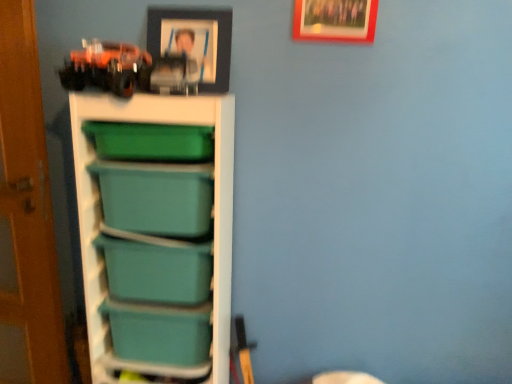
Image resolution: width=512 pixels, height=384 pixels. Describe the element at coordinates (159, 332) in the screenshot. I see `teal plastic storage bin at center, placed as the first box when sorted from bottom to top` at that location.

I want to click on teal plastic storage at left, so click(x=99, y=214).

What do you see at coordinates (99, 214) in the screenshot? This screenshot has height=384, width=512. I see `teal plastic storage at left` at bounding box center [99, 214].

How much space does wooden picture frame at upper center, which ranks as the second picture frame in left-to-right order, occupy horizontally?

wooden picture frame at upper center, which ranks as the second picture frame in left-to-right order, is 0.62 inches wide.

At what (x,y) coordinates should I click in order to perform the action: click on teal plastic storage bin at center, placed as the first box when sorted from bottom to top. Please return your answer as a coordinate pair (x, y). Looking at the image, I should click on (159, 332).

Can you confirm if teal plastic storage bin at center, placed as the first box when sorted from bottom to top, is wider than wooden picture frame at upper center, which ranks as the first picture frame in right-to-left order?

Yes.

Is teal plastic storage bin at center, the 2th box in the top-to-bottom sequence, further to the viewer compared to wooden picture frame at upper center, which ranks as the second picture frame in left-to-right order?

Yes, it is behind wooden picture frame at upper center, which ranks as the second picture frame in left-to-right order.

Which of these two, teal plastic storage bin at center, placed as the first box when sorted from bottom to top, or wooden picture frame at upper center, which ranks as the second picture frame in left-to-right order, is bigger?

teal plastic storage bin at center, placed as the first box when sorted from bottom to top.

Is wooden picture frame at upper center, which ranks as the second picture frame in left-to-right order, a part of teal plastic storage bin at center, the 2th box in the top-to-bottom sequence?

No, wooden picture frame at upper center, which ranks as the second picture frame in left-to-right order, is located outside of teal plastic storage bin at center, the 2th box in the top-to-bottom sequence.

Does point (296, 25) come behind point (169, 315)?

No.

From the image's perspective, would you say wooden picture frame at upper center, which ranks as the second picture frame in left-to-right order, is positioned over teal plastic storage bin at center, placed as the first box when sorted from bottom to top?

Indeed, from the image's perspective, wooden picture frame at upper center, which ranks as the second picture frame in left-to-right order, is shown above teal plastic storage bin at center, placed as the first box when sorted from bottom to top.

In the image, is wooden picture frame at upper center, which ranks as the first picture frame in right-to-left order, positioned in front of or behind teal plastic storage bin at center, placed as the first box when sorted from bottom to top?

Clearly, wooden picture frame at upper center, which ranks as the first picture frame in right-to-left order, is in front of teal plastic storage bin at center, placed as the first box when sorted from bottom to top.

Visually, is wooden picture frame at upper center, which ranks as the second picture frame in left-to-right order, positioned to the left or to the right of teal plastic storage bin at center, the 2th box in the top-to-bottom sequence?

wooden picture frame at upper center, which ranks as the second picture frame in left-to-right order, is to the right of teal plastic storage bin at center, the 2th box in the top-to-bottom sequence.

Considering the relative sizes of teal plastic storage bin at center, the 2th box in the top-to-bottom sequence, and matte black picture frame at upper center, the 1th picture frame in the left-to-right sequence, in the image provided, is teal plastic storage bin at center, the 2th box in the top-to-bottom sequence, thinner than matte black picture frame at upper center, the 1th picture frame in the left-to-right sequence,?

No.

Is teal plastic storage bin at center, placed as the first box when sorted from bottom to top, oriented towards matte black picture frame at upper center, arranged as the second picture frame when viewed from the right?

No.

From a real-world perspective, which is physically above, teal plastic storage bin at center, the 2th box in the top-to-bottom sequence, or matte black picture frame at upper center, arranged as the second picture frame when viewed from the right?

matte black picture frame at upper center, arranged as the second picture frame when viewed from the right, from a real-world perspective.

Measure the distance from teal plastic storage bin at center, the 2th box in the top-to-bottom sequence, to matte black picture frame at upper center, arranged as the second picture frame when viewed from the right.

They are 90.57 centimeters apart.

Could you tell me if matte black picture frame at upper center, the 1th picture frame in the left-to-right sequence, is turned towards wooden picture frame at upper center, which ranks as the first picture frame in right-to-left order?

No.

Is matte black picture frame at upper center, arranged as the second picture frame when viewed from the right, next to wooden picture frame at upper center, which ranks as the first picture frame in right-to-left order, and touching it?

No, matte black picture frame at upper center, arranged as the second picture frame when viewed from the right, is not touching wooden picture frame at upper center, which ranks as the first picture frame in right-to-left order.

Which object is further away from the camera, matte black picture frame at upper center, arranged as the second picture frame when viewed from the right, or wooden picture frame at upper center, which ranks as the second picture frame in left-to-right order?

Positioned behind is matte black picture frame at upper center, arranged as the second picture frame when viewed from the right.

From a real-world perspective, is matte black picture frame at upper center, the 1th picture frame in the left-to-right sequence, above or below wooden picture frame at upper center, which ranks as the first picture frame in right-to-left order?

matte black picture frame at upper center, the 1th picture frame in the left-to-right sequence, is situated lower than wooden picture frame at upper center, which ranks as the first picture frame in right-to-left order, in the real world.

Is teal plastic storage bin at center, which is the 2th box in bottom-to-top order, located within wooden picture frame at upper center, which ranks as the first picture frame in right-to-left order?

No, teal plastic storage bin at center, which is the 2th box in bottom-to-top order, is located outside of wooden picture frame at upper center, which ranks as the first picture frame in right-to-left order.

Considering the relative positions of wooden picture frame at upper center, which ranks as the first picture frame in right-to-left order, and teal plastic storage bin at center, marked as the 1th box in a top-to-bottom arrangement, in the image provided, is wooden picture frame at upper center, which ranks as the first picture frame in right-to-left order, to the left of teal plastic storage bin at center, marked as the 1th box in a top-to-bottom arrangement, from the viewer's perspective?

In fact, wooden picture frame at upper center, which ranks as the first picture frame in right-to-left order, is to the right of teal plastic storage bin at center, marked as the 1th box in a top-to-bottom arrangement.

Is point (365, 7) closer or farther from the camera than point (132, 254)?

Point (365, 7).

Looking at their sizes, would you say wooden picture frame at upper center, which ranks as the first picture frame in right-to-left order, is wider or thinner than teal plastic storage at left?

wooden picture frame at upper center, which ranks as the first picture frame in right-to-left order, is thinner than teal plastic storage at left.

Is wooden picture frame at upper center, which ranks as the second picture frame in left-to-right order, situated inside teal plastic storage at left or outside?

wooden picture frame at upper center, which ranks as the second picture frame in left-to-right order, cannot be found inside teal plastic storage at left.

How much distance is there between wooden picture frame at upper center, which ranks as the second picture frame in left-to-right order, and teal plastic storage at left?

wooden picture frame at upper center, which ranks as the second picture frame in left-to-right order, is 26.57 inches from teal plastic storage at left.

Between point (327, 16) and point (215, 270), which one is positioned behind?

The point (327, 16) is behind.

From the picture: Can you confirm if teal plastic storage bin at center, marked as the 1th box in a top-to-bottom arrangement, is wider than matte black picture frame at upper center, the 1th picture frame in the left-to-right sequence?

Yes.

Is teal plastic storage bin at center, marked as the 1th box in a top-to-bottom arrangement, not within matte black picture frame at upper center, the 1th picture frame in the left-to-right sequence?

Yes, teal plastic storage bin at center, marked as the 1th box in a top-to-bottom arrangement, is outside of matte black picture frame at upper center, the 1th picture frame in the left-to-right sequence.

From a real-world perspective, who is located lower, teal plastic storage bin at center, marked as the 1th box in a top-to-bottom arrangement, or matte black picture frame at upper center, arranged as the second picture frame when viewed from the right?

teal plastic storage bin at center, marked as the 1th box in a top-to-bottom arrangement, is physically lower.

From the image's perspective, would you say teal plastic storage bin at center, which is the 2th box in bottom-to-top order, is positioned over matte black picture frame at upper center, the 1th picture frame in the left-to-right sequence?

Actually, teal plastic storage bin at center, which is the 2th box in bottom-to-top order, appears below matte black picture frame at upper center, the 1th picture frame in the left-to-right sequence, in the image.

Identify the location of picture frame that is the 2nd object located in front of the teal plastic storage bin at center, the 2th box in the top-to-bottom sequence. The width and height of the screenshot is (512, 384). (335, 20).

Where is `the 2nd picture frame above the teal plastic storage bin at center, the 2th box in the top-to-bottom sequence (from a real-world perspective)`? The image size is (512, 384). the 2nd picture frame above the teal plastic storage bin at center, the 2th box in the top-to-bottom sequence (from a real-world perspective) is located at coordinates (335, 20).

From the image, which object appears to be nearer to teal plastic storage bin at center, the 2th box in the top-to-bottom sequence, teal plastic storage at left or wooden picture frame at upper center, which ranks as the first picture frame in right-to-left order?

The object closer to teal plastic storage bin at center, the 2th box in the top-to-bottom sequence, is teal plastic storage at left.

Considering their positions, is matte black picture frame at upper center, arranged as the second picture frame when viewed from the right, positioned further to teal plastic storage at left than teal plastic storage bin at center, the 2th box in the top-to-bottom sequence?

matte black picture frame at upper center, arranged as the second picture frame when viewed from the right.

Consider the image. Based on their spatial positions, is teal plastic storage at left or teal plastic storage bin at center, which is the 2th box in bottom-to-top order, closer to matte black picture frame at upper center, the 1th picture frame in the left-to-right sequence?

teal plastic storage at left.

Estimate the real-world distances between objects in this image. Which object is closer to teal plastic storage bin at center, the 2th box in the top-to-bottom sequence, matte black picture frame at upper center, the 1th picture frame in the left-to-right sequence, or wooden picture frame at upper center, which ranks as the second picture frame in left-to-right order?

matte black picture frame at upper center, the 1th picture frame in the left-to-right sequence, lies closer to teal plastic storage bin at center, the 2th box in the top-to-bottom sequence, than the other object.

Looking at the image, which one is located closer to teal plastic storage bin at center, marked as the 1th box in a top-to-bottom arrangement, wooden picture frame at upper center, which ranks as the first picture frame in right-to-left order, or matte black picture frame at upper center, the 1th picture frame in the left-to-right sequence?

The object closer to teal plastic storage bin at center, marked as the 1th box in a top-to-bottom arrangement, is matte black picture frame at upper center, the 1th picture frame in the left-to-right sequence.

Looking at the image, which one is located closer to teal plastic storage at left, teal plastic storage bin at center, marked as the 1th box in a top-to-bottom arrangement, or teal plastic storage bin at center, the 2th box in the top-to-bottom sequence?

teal plastic storage bin at center, marked as the 1th box in a top-to-bottom arrangement, is closer to teal plastic storage at left.

When comparing their distances from teal plastic storage at left, does teal plastic storage bin at center, which is the 2th box in bottom-to-top order, or matte black picture frame at upper center, arranged as the second picture frame when viewed from the right, seem further?

Based on the image, matte black picture frame at upper center, arranged as the second picture frame when viewed from the right, appears to be further to teal plastic storage at left.

Estimate the real-world distances between objects in this image. Which object is closer to teal plastic storage bin at center, the 2th box in the top-to-bottom sequence, wooden picture frame at upper center, which ranks as the second picture frame in left-to-right order, or matte black picture frame at upper center, arranged as the second picture frame when viewed from the right?

matte black picture frame at upper center, arranged as the second picture frame when viewed from the right, lies closer to teal plastic storage bin at center, the 2th box in the top-to-bottom sequence, than the other object.

Locate an element on the screen. The image size is (512, 384). box between matte black picture frame at upper center, the 1th picture frame in the left-to-right sequence, and teal plastic storage bin at center, the 2th box in the top-to-bottom sequence, from top to bottom is located at coordinates (156, 271).

This screenshot has width=512, height=384. What are the coordinates of `picture frame between wooden picture frame at upper center, which ranks as the first picture frame in right-to-left order, and teal plastic storage bin at center, the 2th box in the top-to-bottom sequence, in the vertical direction` in the screenshot? It's located at (194, 40).

This screenshot has height=384, width=512. I want to click on picture frame between wooden picture frame at upper center, which ranks as the second picture frame in left-to-right order, and teal plastic storage at left in the up-down direction, so click(x=194, y=40).

Where is `shelf between matte black picture frame at upper center, arranged as the second picture frame when viewed from the right, and teal plastic storage bin at center, placed as the first box when sorted from bottom to top, in the up-down direction`? shelf between matte black picture frame at upper center, arranged as the second picture frame when viewed from the right, and teal plastic storage bin at center, placed as the first box when sorted from bottom to top, in the up-down direction is located at coordinates (99, 214).